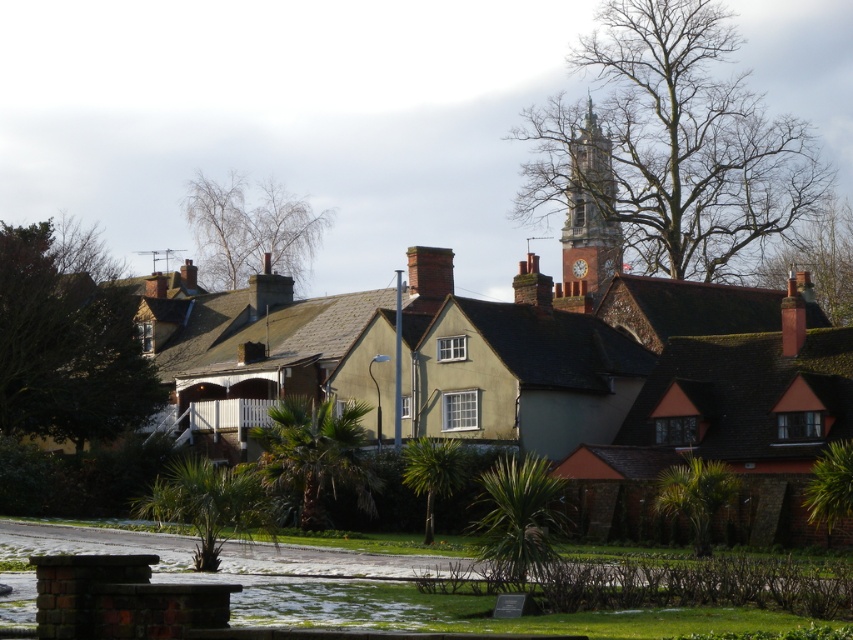
Does brick clock tower at upper center appear on the left side of brown brick chimney at center?

In fact, brick clock tower at upper center is to the right of brown brick chimney at center.

Which is in front, point (614, 224) or point (410, 266)?

Point (410, 266) is in front.

Does point (602, 150) come in front of point (437, 266)?

No, it is not.

At what (x,y) coordinates should I click in order to perform the action: click on brick clock tower at upper center. Please return your answer as a coordinate pair (x, y). The height and width of the screenshot is (640, 853). Looking at the image, I should click on (x=589, y=218).